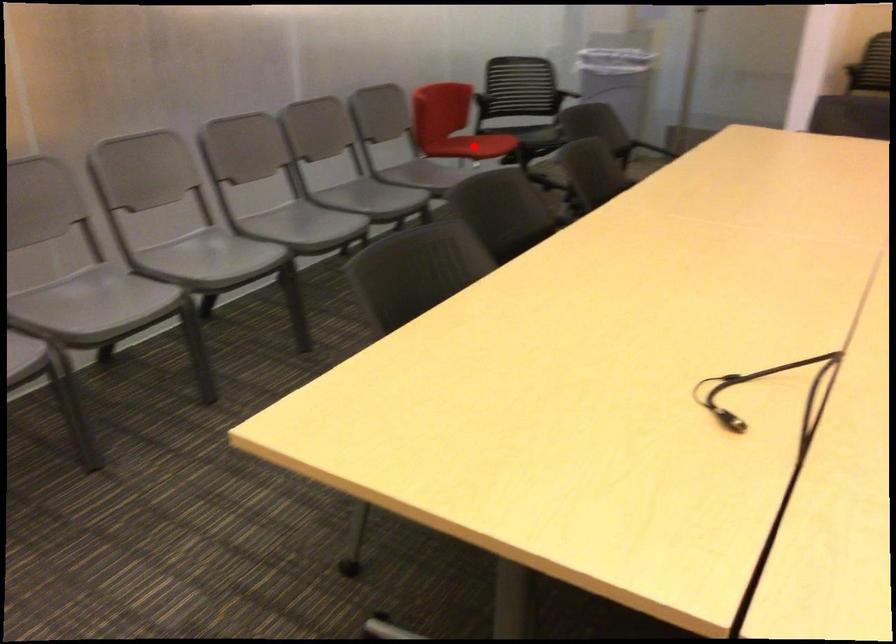
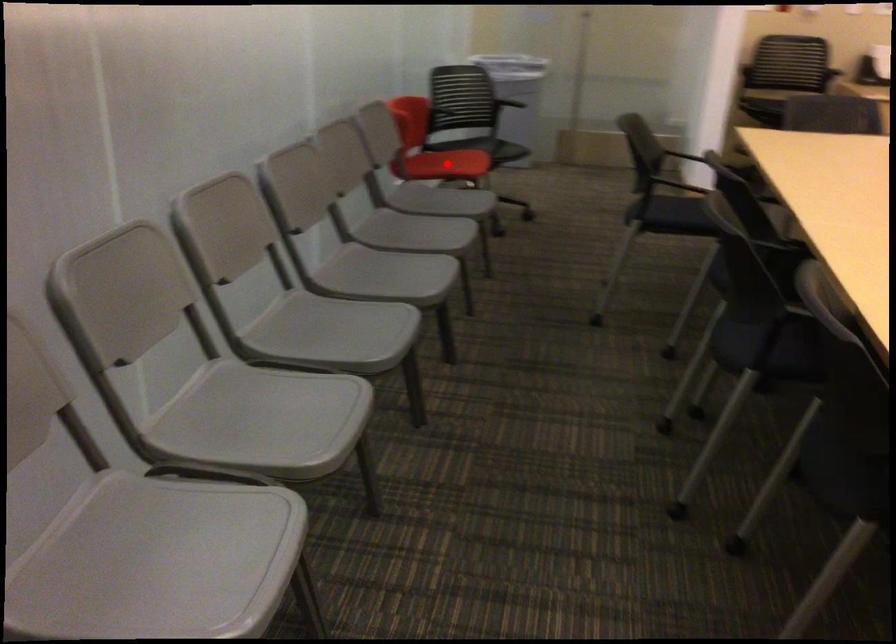
I am providing you with two images of the same scene from different viewpoints. A red point is marked on the first image and another point is marked on the second image. Are the points marked in image1 and image2 representing the same 3D position?

Yes